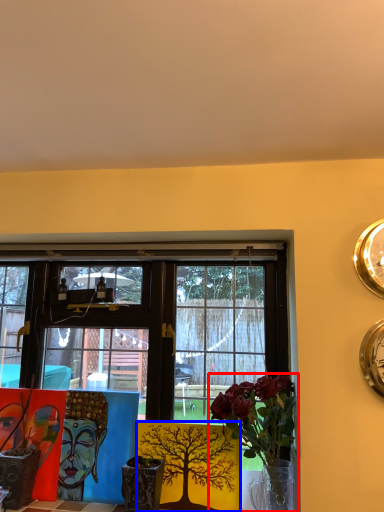
Question: Which object is closer to the camera taking this photo, houseplant (highlighted by a red box) or floral arrangement (highlighted by a blue box)?

Choices:
 (A) houseplant
 (B) floral arrangement

Answer: (A)